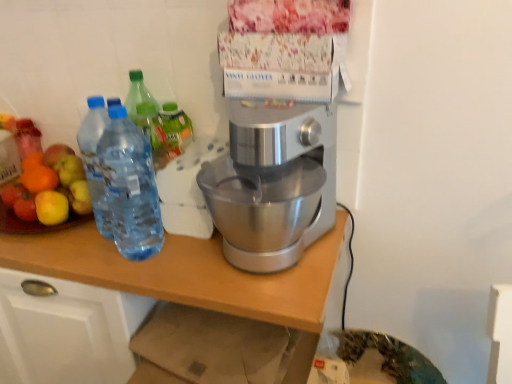
Identify the location of vacant space to the right of transparent plastic bottles at left. (205, 268).